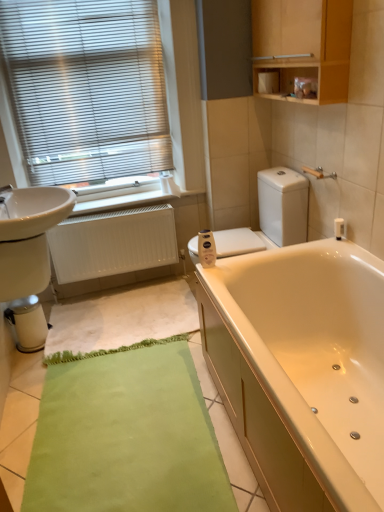
Question: Based on their positions, is metallic blinds at upper left located to the left or right of white glossy toilet at center?

Choices:
 (A) right
 (B) left

Answer: (B)

Question: In the image, is metallic blinds at upper left positioned in front of or behind white glossy toilet at center?

Choices:
 (A) behind
 (B) front

Answer: (A)

Question: Which object is positioned closest to the white textured bath mat at lower center?

Choices:
 (A) white matte toilet paper at center, which is the first toilet paper in bottom-to-top order
 (B) metallic silver water heater at lower left
 (C) white glossy toilet at center
 (D) wooden cabinet at upper right
 (E) metallic blinds at upper left

Answer: (B)

Question: Estimate the real-world distances between objects in this image. Which object is closer to the metallic silver water heater at lower left?

Choices:
 (A) wooden cabinet at upper right
 (B) white matte radiator at lower left
 (C) white matte toilet paper at upper center, the 1th toilet paper from the back
 (D) white glossy toilet at center
 (E) white textured bath mat at lower center

Answer: (E)